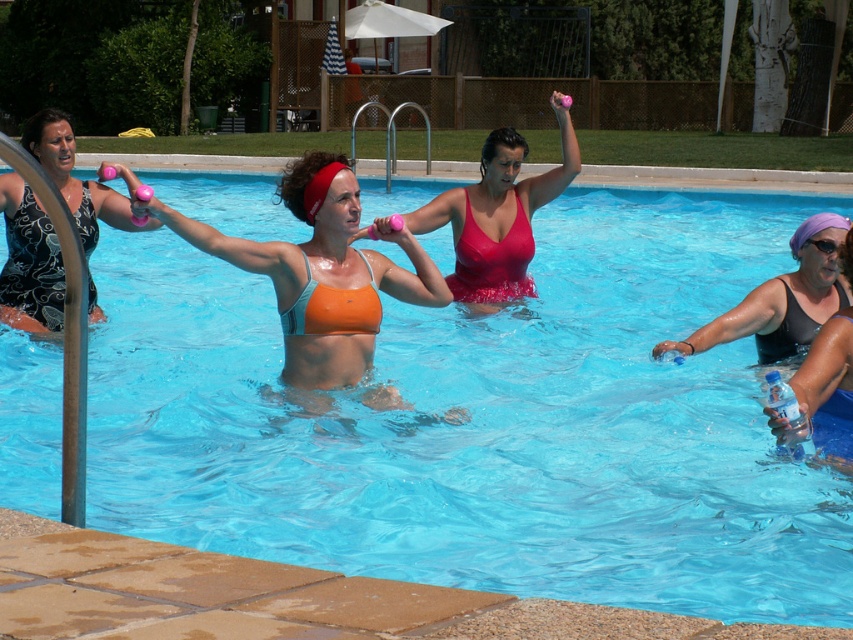
Question: Which point is closer to the camera?

Choices:
 (A) purple rubber goggles at upper right
 (B) shiny red bikini at center
 (C) orange bikini at upper center
 (D) matte black swimsuit at left

Answer: (D)

Question: Which point is closer to the camera?

Choices:
 (A) orange fabric bikini at center
 (B) blue glossy water at center

Answer: (B)

Question: Is matte orange swimsuit at center to the left of orange bikini at upper center from the viewer's perspective?

Choices:
 (A) yes
 (B) no

Answer: (B)

Question: Does blue glossy water at center appear under purple fabric swim cap at right?

Choices:
 (A) no
 (B) yes

Answer: (A)

Question: Is orange fabric bikini at center thinner than orange bikini at upper center?

Choices:
 (A) no
 (B) yes

Answer: (B)

Question: Which object is the closest to the purple rubber goggles at upper right?

Choices:
 (A) shiny red bikini at center
 (B) matte black swimsuit at left
 (C) blue glossy water at center

Answer: (A)